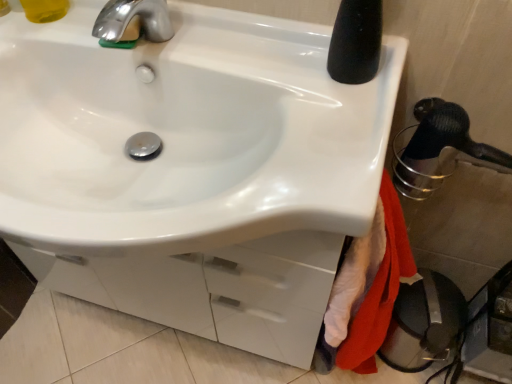
Where is `free space in front of translucent yellow liquid at upper left`? The height and width of the screenshot is (384, 512). free space in front of translucent yellow liquid at upper left is located at coordinates (44, 38).